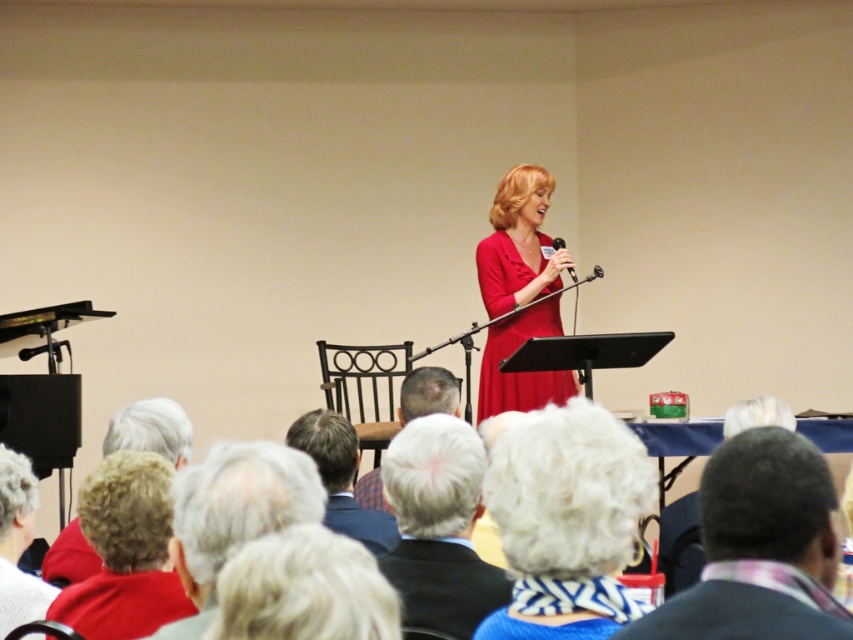
You are an event planner trying to set up a new microphone stand for the next speaker. You need to place it between the light brown wood chair at center and the metallic silver microphone at center. Which object should you place the stand closer to so that it doesn

The light brown wood chair at center is bigger than the metallic silver microphone at center, so you should place the microphone stand closer to the metallic silver microphone at center to ensure there is enough space around the larger chair.

You are organizing a charity event and need to arrange a photo shoot. You have a wide camera lens that can capture objects up to 1 meter in width. You see the matte red dress at center and the gray knit hat at lower left in the scene. Can both objects fit within the camera lens frame at the same time?

The matte red dress at center is wider than the gray knit hat at lower left. Since the camera lens can capture up to 1 meter in width, you need to check if the combined width of both objects is within the limit. However, the description only states the dress is wider than the hat but does not provide exact measurements. Without knowing the exact widths, it is impossible to determine if they can fit together within the 1 meter limit.